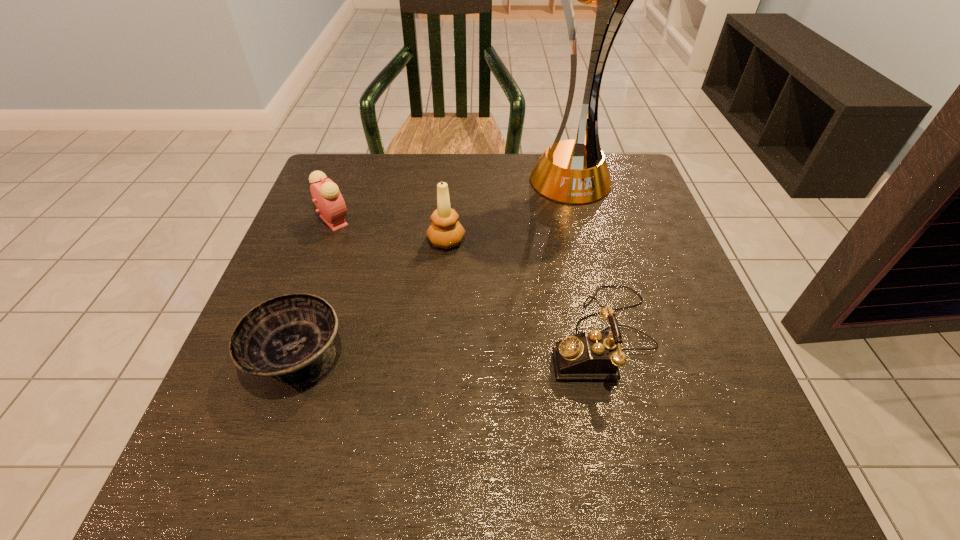
I want to click on trophy, so click(x=575, y=171).

The height and width of the screenshot is (540, 960). In order to click on the tallest object in this screenshot , I will do `click(575, 171)`.

Identify the location of candle_holder. (445, 231).

What are the coordinates of `the fourth shortest object` in the screenshot? It's located at coord(445,231).

Where is `alarm clock`? alarm clock is located at coordinates (325, 193).

The image size is (960, 540). I want to click on telephone, so click(591, 355).

Find the location of a particular element. The width and height of the screenshot is (960, 540). the shortest object is located at coordinates (289, 338).

The image size is (960, 540). What are the coordinates of `vacant space located on the front-facing side of the farthest object` in the screenshot? It's located at (578, 218).

The width and height of the screenshot is (960, 540). Find the location of `free space located 0.200m on the front of the third object from right to left`. free space located 0.200m on the front of the third object from right to left is located at coordinates (440, 328).

Identify the location of free location located 0.290m on the face of the alarm clock. Image resolution: width=960 pixels, height=540 pixels. (477, 220).